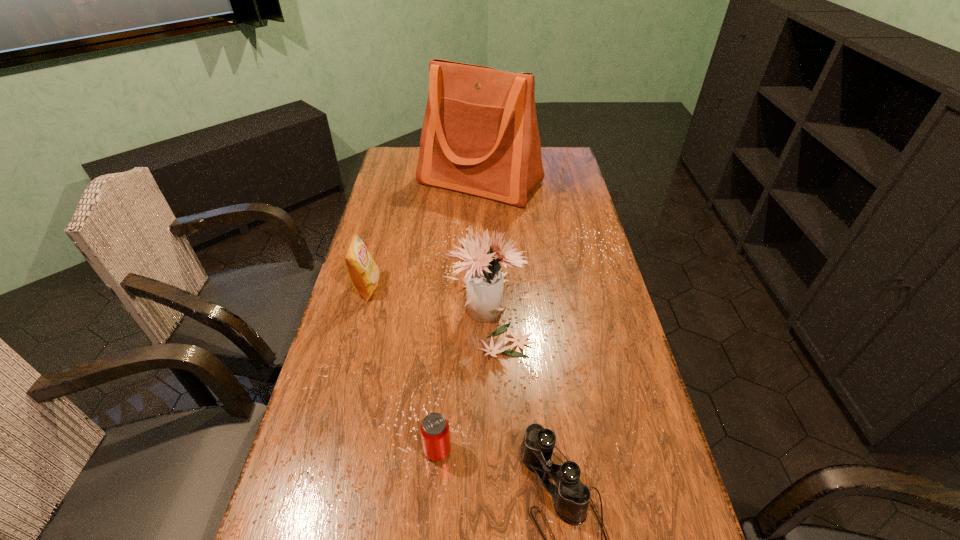
At what (x,y) coordinates should I click in order to perform the action: click on object that is at the far edge. Please return your answer as a coordinate pair (x, y). This screenshot has width=960, height=540. Looking at the image, I should click on (480, 136).

You are a GUI agent. You are given a task and a screenshot of the screen. Output one action in this format:
    pyautogui.click(x=<x>, y=<y>)
    Task: Click on the shopping bag at the left edge
    
    Given the screenshot: What is the action you would take?
    [480, 136]

This screenshot has width=960, height=540. Find the location of `crisp (potato chip) located at the left edge`. crisp (potato chip) located at the left edge is located at coordinates (362, 270).

Where is `object located at the right edge`? object located at the right edge is located at coordinates (480, 136).

Where is `object that is at the far left corner`? This screenshot has width=960, height=540. object that is at the far left corner is located at coordinates (480, 136).

Locate an element on the screen. object present at the far right corner is located at coordinates (480, 136).

In the image, there is a desktop. Find the location of `free space at the left edge`. free space at the left edge is located at coordinates (292, 534).

Locate an element on the screen. This screenshot has height=540, width=960. free space at the right edge of the desktop is located at coordinates (567, 198).

In the image, there is a desktop. Where is `free space at the far left corner`? The height and width of the screenshot is (540, 960). free space at the far left corner is located at coordinates (413, 173).

Find the location of `free space that is in between the can and the shopping bag`. free space that is in between the can and the shopping bag is located at coordinates (459, 316).